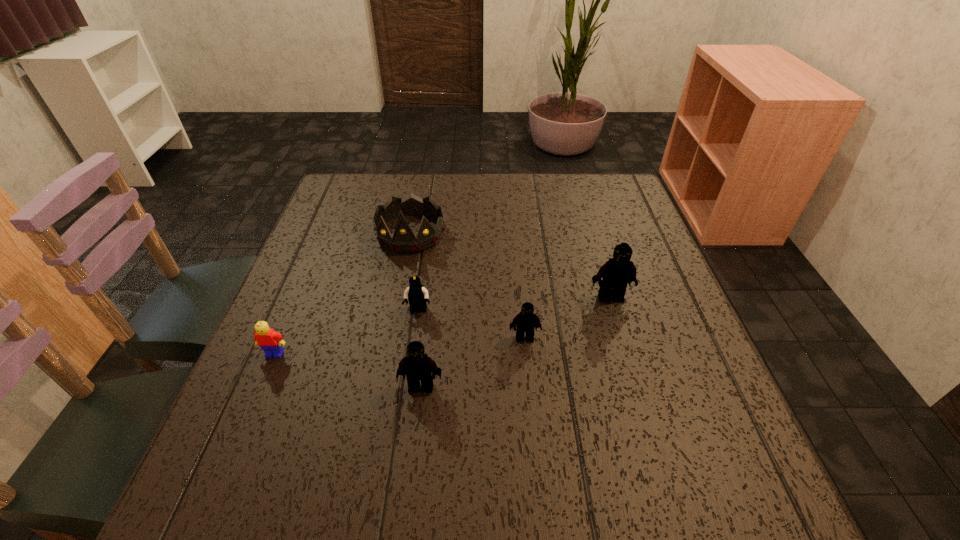
All Legos are currently evenly spaced. To continue this pattern, where would you add another Lego on the left? Please point out a vacant spot. Please provide its 2D coordinates. Your answer should be formatted as a tuple, i.e. [(x, y)], where the tuple contains the x and y coordinates of a point satisfying the conditions above.

[(293, 447)]